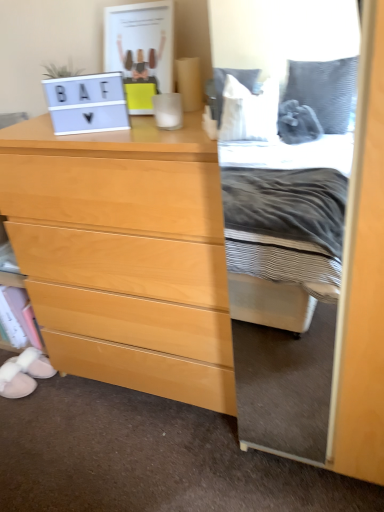
Image resolution: width=384 pixels, height=512 pixels. I want to click on vacant area that lies in front of white suede slipper at lower left, acting as the first shoe starting from the front, so click(14, 419).